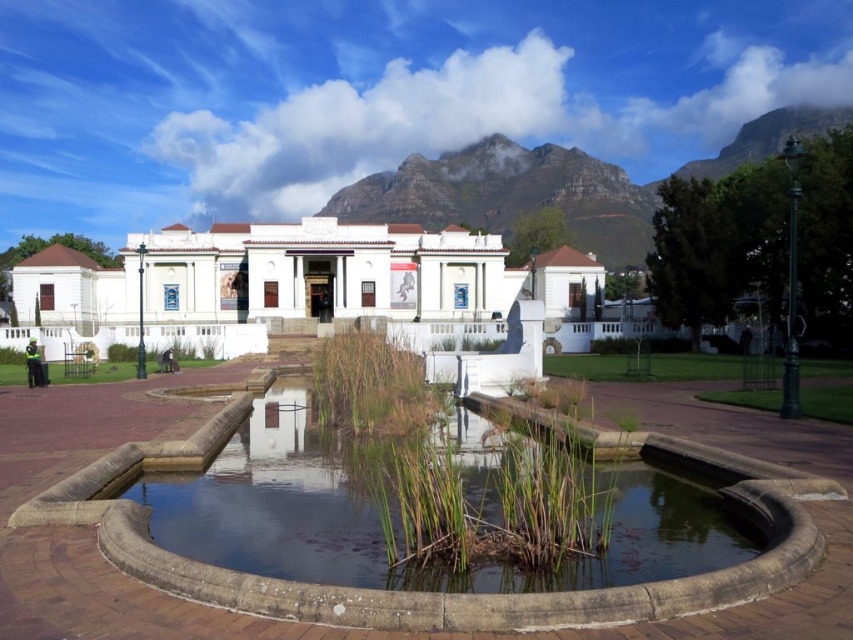
You are standing in front of the white smooth building at center and want to take a photo of the rugged stone mountain at upper center. Which direction should you turn to face the mountain?

You should turn to your right to face the rugged stone mountain at upper center because the white smooth building at center is positioned on the left side of it.